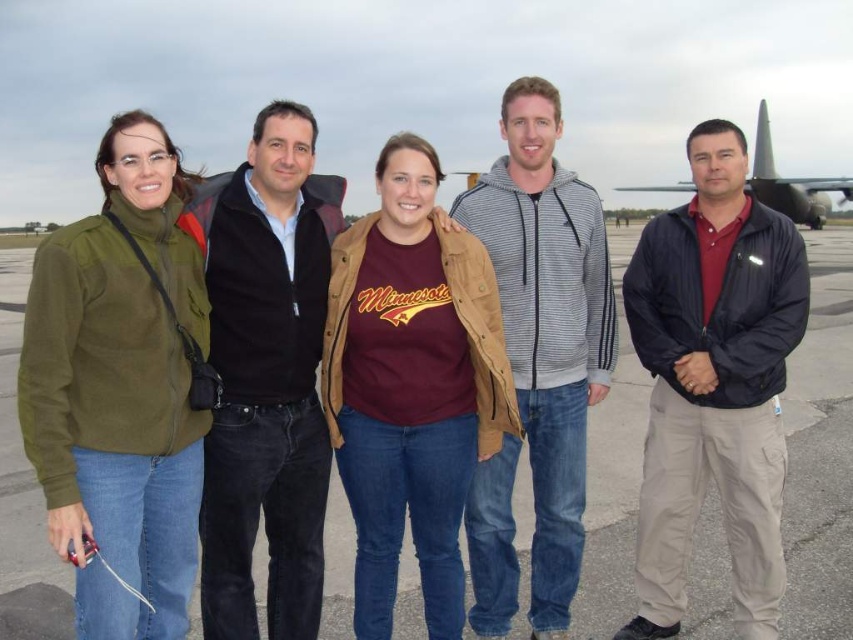
Question: Does black fleece jacket at center appear under gray asphalt tarmac at center?

Choices:
 (A) no
 (B) yes

Answer: (B)

Question: Which object is positioned closest to the gray asphalt tarmac at center?

Choices:
 (A) metallic gray airplane at right
 (B) maroon cotton t-shirt at center

Answer: (B)

Question: Can you confirm if gray asphalt tarmac at center is positioned to the left of metallic gray airplane at right?

Choices:
 (A) no
 (B) yes

Answer: (B)

Question: Which of the following is the farthest from the observer?

Choices:
 (A) (839, 182)
 (B) (355, 608)
 (C) (415, 579)
 (D) (770, 577)

Answer: (A)

Question: Which object is positioned closest to the striped hoodie at center?

Choices:
 (A) maroon cotton t-shirt at center
 (B) metallic gray airplane at right
 (C) gray asphalt tarmac at center

Answer: (A)

Question: Does maroon cotton t-shirt at center have a greater width compared to gray asphalt tarmac at center?

Choices:
 (A) yes
 (B) no

Answer: (B)